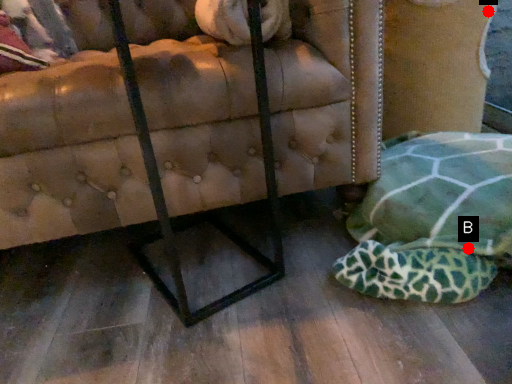
Question: Two points are circled on the image, labeled by A and B beside each circle. Among these points, which one is farthest from the camera?

Choices:
 (A) A is further
 (B) B is further

Answer: (A)